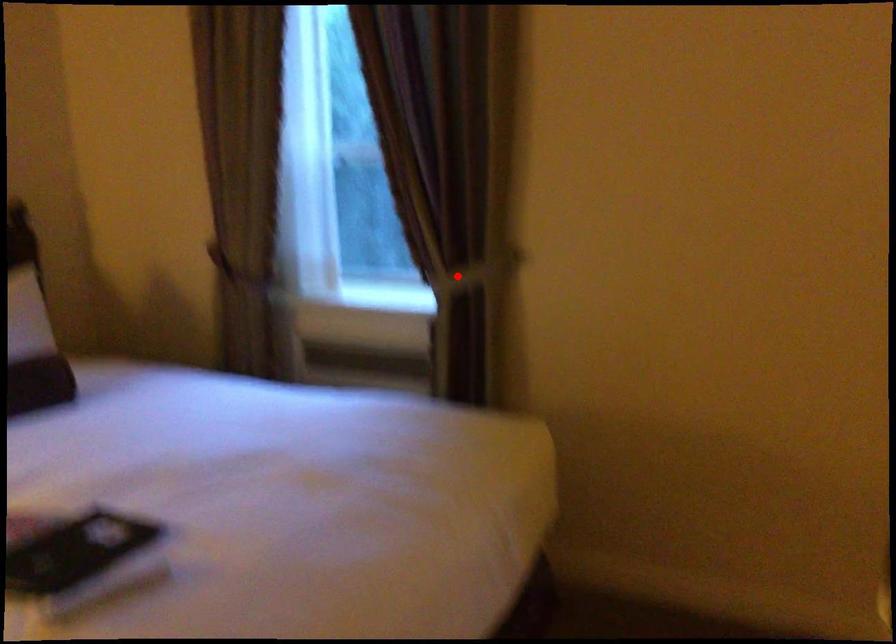
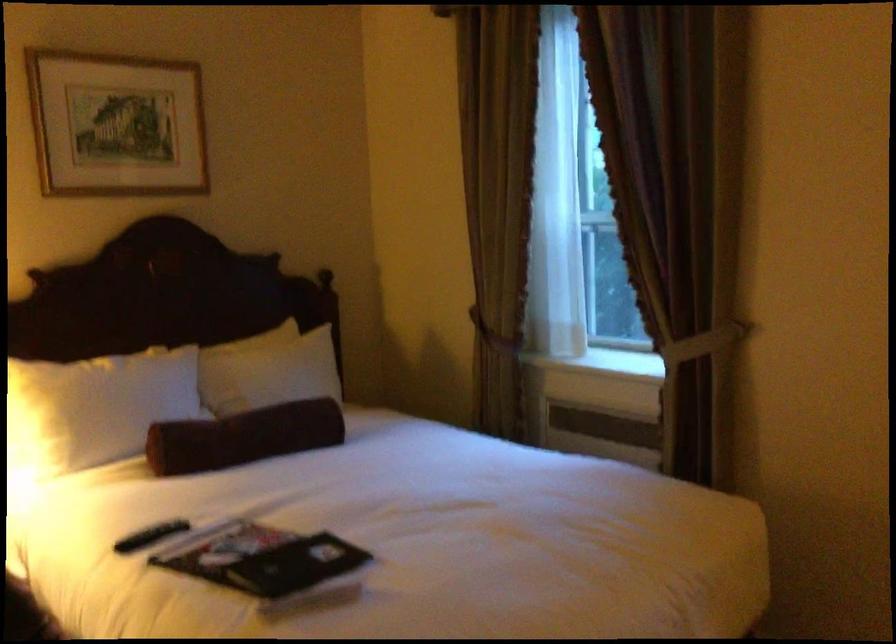
Where in the second image is the point corresponding to the highlighted location from the first image?

(686, 348)